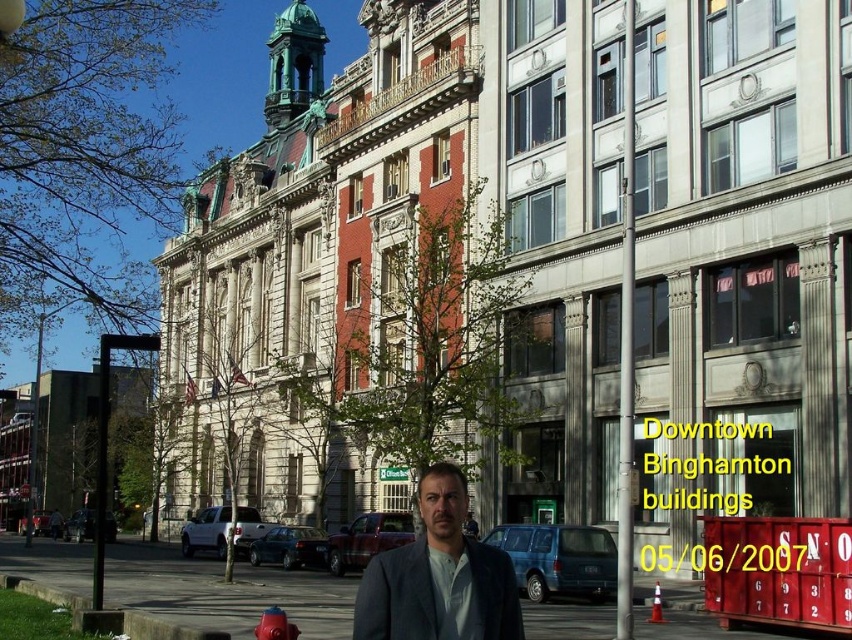
Is gray asphalt pavement at lower center taller than red matte fire hydrant at lower center?

Yes, gray asphalt pavement at lower center is taller than red matte fire hydrant at lower center.

Does point (56, 572) come farther from viewer compared to point (278, 634)?

Yes, it is behind point (278, 634).

Locate an element on the screen. This screenshot has width=852, height=640. gray asphalt pavement at lower center is located at coordinates (225, 592).

Who is more distant from viewer, (461, 570) or (286, 628)?

The point (286, 628) is more distant.

Image resolution: width=852 pixels, height=640 pixels. What do you see at coordinates (439, 577) in the screenshot?
I see `matte gray suit at center` at bounding box center [439, 577].

The height and width of the screenshot is (640, 852). In order to click on matte gray suit at center in this screenshot , I will do `click(439, 577)`.

Is gray asphalt pavement at lower center taller than matte gray suit at center?

Yes, gray asphalt pavement at lower center is taller than matte gray suit at center.

Describe the element at coordinates (225, 592) in the screenshot. I see `gray asphalt pavement at lower center` at that location.

This screenshot has height=640, width=852. In order to click on gray asphalt pavement at lower center in this screenshot , I will do `click(225, 592)`.